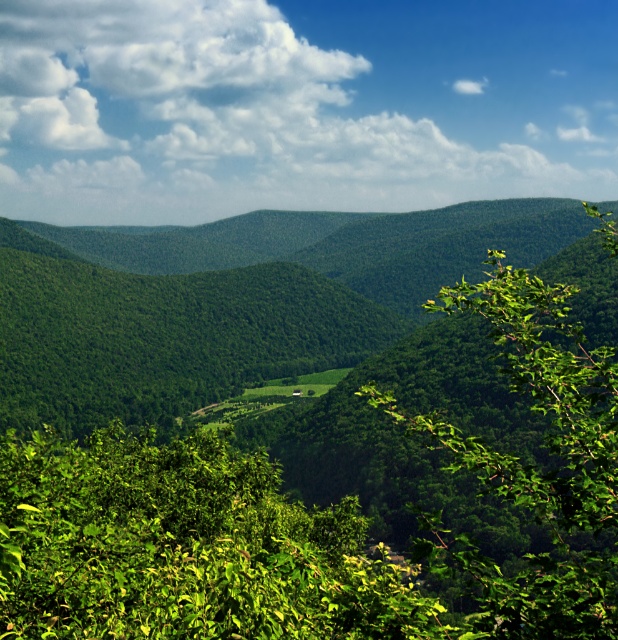
Question: In this image, where is white fluffy cloud at upper center located relative to green leafy tree at center?

Choices:
 (A) above
 (B) below

Answer: (A)

Question: Which of the following is the farthest from the observer?

Choices:
 (A) green leafy tree at center
 (B) white fluffy cloud at upper center

Answer: (B)

Question: Does white fluffy cloud at upper center have a lesser width compared to green leafy tree at center?

Choices:
 (A) no
 (B) yes

Answer: (A)

Question: Which of the following is the farthest from the observer?

Choices:
 (A) pyautogui.click(x=197, y=124)
 (B) pyautogui.click(x=66, y=468)

Answer: (A)

Question: Does white fluffy cloud at upper center appear on the left side of green leafy tree at center?

Choices:
 (A) no
 (B) yes

Answer: (A)